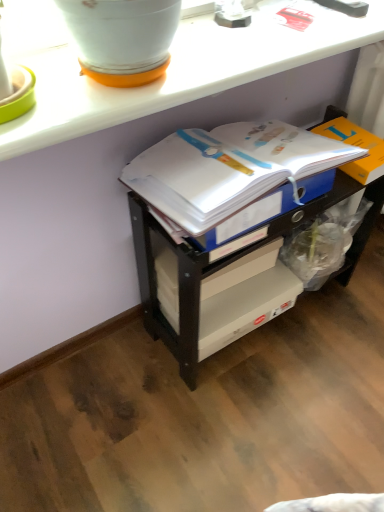
Question: Is the depth of white glossy flowerpot at upper left greater than that of orange cardboard box at right?

Choices:
 (A) yes
 (B) no

Answer: (B)

Question: Is white glossy flowerpot at upper left beside orange cardboard box at right?

Choices:
 (A) yes
 (B) no

Answer: (B)

Question: Is white glossy flowerpot at upper left looking in the opposite direction of orange cardboard box at right?

Choices:
 (A) yes
 (B) no

Answer: (B)

Question: Is white glossy flowerpot at upper left not near orange cardboard box at right?

Choices:
 (A) no
 (B) yes

Answer: (A)

Question: From a real-world perspective, does white glossy flowerpot at upper left stand above orange cardboard box at right?

Choices:
 (A) yes
 (B) no

Answer: (A)

Question: From the image's perspective, would you say white glossy flowerpot at upper left is shown under orange cardboard box at right?

Choices:
 (A) no
 (B) yes

Answer: (A)

Question: From a real-world perspective, is orange cardboard box at right located beneath white plastic shelf at center?

Choices:
 (A) yes
 (B) no

Answer: (B)

Question: Can you see orange cardboard box at right touching white plastic shelf at center?

Choices:
 (A) no
 (B) yes

Answer: (A)

Question: From a real-world perspective, does orange cardboard box at right stand above white plastic shelf at center?

Choices:
 (A) no
 (B) yes

Answer: (B)

Question: From the image's perspective, is orange cardboard box at right located beneath white plastic shelf at center?

Choices:
 (A) yes
 (B) no

Answer: (B)

Question: Can you confirm if orange cardboard box at right is thinner than white plastic shelf at center?

Choices:
 (A) yes
 (B) no

Answer: (A)

Question: Does orange cardboard box at right have a larger size compared to white plastic shelf at center?

Choices:
 (A) no
 (B) yes

Answer: (A)

Question: Are white paper journal at center and white glossy counter at upper center located far from each other?

Choices:
 (A) yes
 (B) no

Answer: (B)